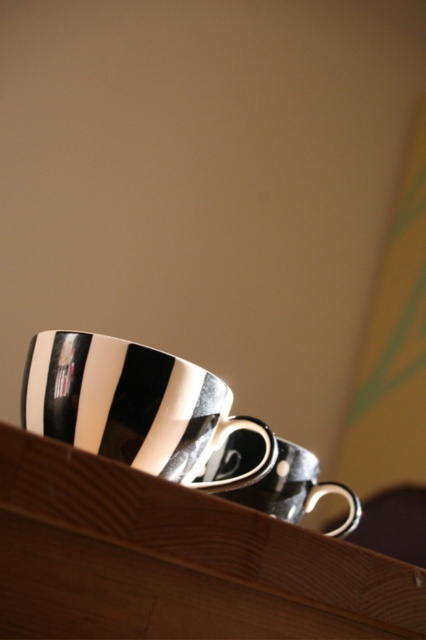
Question: Which point is closer to the camera taking this photo?

Choices:
 (A) (293, 445)
 (B) (219, 397)
 (C) (345, 547)

Answer: (C)

Question: Which point appears farthest from the camera in this image?

Choices:
 (A) coord(92,358)
 (B) coord(262,440)

Answer: (B)

Question: Does black glossy mug at upper center appear under black glossy mug at center?

Choices:
 (A) no
 (B) yes

Answer: (A)

Question: Which object is the farthest from the black glossy saucer at center?

Choices:
 (A) wooden shelf at upper center
 (B) black glossy mug at center
 (C) black glossy mug at upper center

Answer: (A)

Question: Can you confirm if black glossy mug at center is wider than black glossy saucer at center?

Choices:
 (A) no
 (B) yes

Answer: (B)

Question: Does black glossy mug at center lie in front of black glossy saucer at center?

Choices:
 (A) no
 (B) yes

Answer: (A)